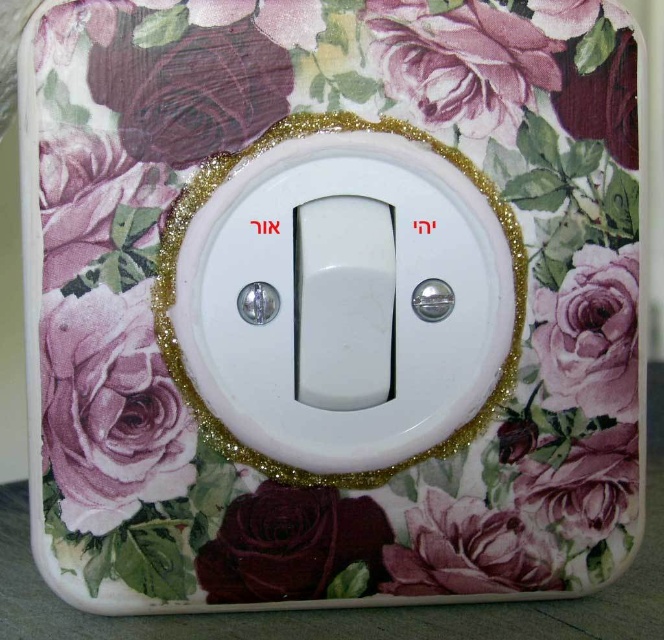
You are standing in front of the light switch with the floral design. You notice two points marked on the switch cover. The first point is at coordinate point(143, 352) and the second is at point(236, 124). From your perspective, which point is closer to you?

Point(236, 124) is closer to you because point(143, 352) is behind it.

You are standing in front of the light switch with two points marked on it. The points are labeled as point 1 at coordinates (333, 557) and point 2 at coordinates (566, 364). Which point is closer to you?

Point 1 at coordinates (333, 557) is closer to the viewer than point 2 at coordinates (566, 364).

You are an interior designer looking at the decorative light switch cover. You notice the matte floral rose at lower left and the matte purple rose at upper left. Which of these roses is taller?

The matte floral rose at lower left is taller than the matte purple rose at upper left.